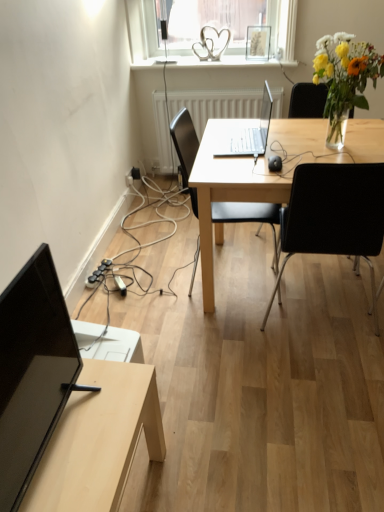
Question: Which direction should I rotate to face black plastic chair at center, the first chair in the right-to-left sequence, — up or down?

Choices:
 (A) up
 (B) down

Answer: (A)

Question: From the image's perspective, is translucent glass vase at upper right under black rubber extension cord at lower left?

Choices:
 (A) no
 (B) yes

Answer: (A)

Question: Is translucent glass vase at upper right wider than black rubber extension cord at lower left?

Choices:
 (A) yes
 (B) no

Answer: (A)

Question: Considering the relative sizes of translucent glass vase at upper right and black rubber extension cord at lower left in the image provided, is translucent glass vase at upper right bigger than black rubber extension cord at lower left?

Choices:
 (A) yes
 (B) no

Answer: (A)

Question: Is translucent glass vase at upper right positioned beyond the bounds of black rubber extension cord at lower left?

Choices:
 (A) no
 (B) yes

Answer: (B)

Question: Is translucent glass vase at upper right behind black rubber extension cord at lower left?

Choices:
 (A) yes
 (B) no

Answer: (B)

Question: Is black rubber extension cord at lower left surrounded by translucent glass vase at upper right?

Choices:
 (A) yes
 (B) no

Answer: (B)

Question: Could you tell me if white textured radiator at center is facing black glossy monitor at lower left?

Choices:
 (A) no
 (B) yes

Answer: (B)

Question: Can you confirm if white textured radiator at center is positioned to the left of black glossy monitor at lower left?

Choices:
 (A) no
 (B) yes

Answer: (A)

Question: Is white textured radiator at center wider than black glossy monitor at lower left?

Choices:
 (A) no
 (B) yes

Answer: (A)

Question: Can you confirm if white textured radiator at center is smaller than black glossy monitor at lower left?

Choices:
 (A) yes
 (B) no

Answer: (B)

Question: From the image's perspective, is white textured radiator at center on top of black glossy monitor at lower left?

Choices:
 (A) no
 (B) yes

Answer: (B)

Question: From the image's perspective, is white textured radiator at center located beneath black glossy monitor at lower left?

Choices:
 (A) yes
 (B) no

Answer: (B)

Question: Can light wood desk at center be found inside white textured radiator at center?

Choices:
 (A) no
 (B) yes

Answer: (A)